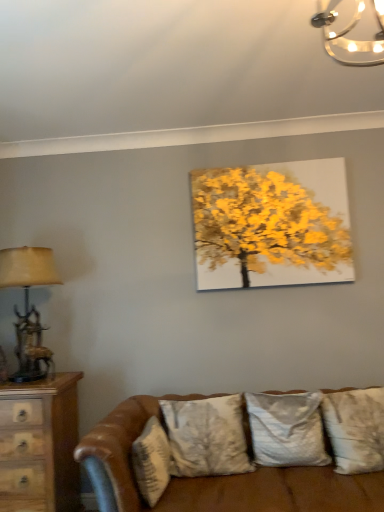
Measure the distance between point (126, 424) and camera.

The depth of point (126, 424) is 2.05 meters.

What do you see at coordinates (213, 477) in the screenshot? The image size is (384, 512). I see `brown leather couch at lower center` at bounding box center [213, 477].

Where is `silky white pillow at center, the 2th pillow viewed from the left`? silky white pillow at center, the 2th pillow viewed from the left is located at coordinates (206, 436).

Describe the element at coordinates (39, 445) in the screenshot. The width and height of the screenshot is (384, 512). I see `wooden chest of drawers at left` at that location.

What do you see at coordinates (350, 31) in the screenshot? I see `metallic glass chandelier at upper right` at bounding box center [350, 31].

This screenshot has width=384, height=512. I want to click on brown leather couch at lower center, so pos(213,477).

Does antler bronze table lamp at left have a greater height compared to wooden chest of drawers at left?

In fact, antler bronze table lamp at left may be shorter than wooden chest of drawers at left.

Could you tell me if antler bronze table lamp at left is turned towards wooden chest of drawers at left?

No, antler bronze table lamp at left does not turn towards wooden chest of drawers at left.

Find the location of a particular element. the chest of drawers in front of the antler bronze table lamp at left is located at coordinates (39, 445).

Is antler bronze table lamp at left located outside wooden chest of drawers at left?

antler bronze table lamp at left lies outside wooden chest of drawers at left's area.

Which point is more distant from viewer, (361,56) or (21,326)?

The point (21,326) is more distant.

Does metallic glass chandelier at upper right have a lesser width compared to antler bronze table lamp at left?

Indeed, metallic glass chandelier at upper right has a lesser width compared to antler bronze table lamp at left.

Which object is positioned more to the left, metallic glass chandelier at upper right or antler bronze table lamp at left?

antler bronze table lamp at left.

From the picture: Can you confirm if brown leather couch at lower center is smaller than antler bronze table lamp at left?

No.

From the picture: From the image's perspective, is brown leather couch at lower center above antler bronze table lamp at left?

No, from the image's perspective, brown leather couch at lower center is not over antler bronze table lamp at left.

Visually, is brown leather couch at lower center positioned to the left or to the right of antler bronze table lamp at left?

Clearly, brown leather couch at lower center is on the right of antler bronze table lamp at left in the image.

How different are the orientations of brown leather couch at lower center and antler bronze table lamp at left in degrees?

0.189 degrees separate the facing orientations of brown leather couch at lower center and antler bronze table lamp at left.

In terms of height, does textured beige pillow at lower right, the 1th pillow when ordered from right to left, look taller or shorter compared to silky white pillow at center, the third pillow viewed from the right?

Clearly, textured beige pillow at lower right, the 1th pillow when ordered from right to left, is shorter compared to silky white pillow at center, the third pillow viewed from the right.

Is point (343, 457) positioned after point (239, 402)?

No.

What's the angular difference between textured beige pillow at lower right, the 1th pillow when ordered from right to left, and silky white pillow at center, the 2th pillow viewed from the left,'s facing directions?

The angular difference between textured beige pillow at lower right, the 1th pillow when ordered from right to left, and silky white pillow at center, the 2th pillow viewed from the left, is 1.16 degrees.

Considering the relative positions of textured beige pillow at lower right, the 1th pillow when ordered from right to left, and silky white pillow at center, the third pillow viewed from the right, in the image provided, is textured beige pillow at lower right, the 1th pillow when ordered from right to left, to the left of silky white pillow at center, the third pillow viewed from the right, from the viewer's perspective?

Incorrect, textured beige pillow at lower right, the 1th pillow when ordered from right to left, is not on the left side of silky white pillow at center, the third pillow viewed from the right.

Is point (343, 449) less distant than point (327, 502)?

No, it is not.

From the picture: Is textured beige pillow at lower right, the 1th pillow when ordered from right to left, beside brown leather couch at lower center?

No, textured beige pillow at lower right, the 1th pillow when ordered from right to left, is not with brown leather couch at lower center.

Considering the sizes of objects textured beige pillow at lower right, the 1th pillow when ordered from right to left, and brown leather couch at lower center in the image provided, who is shorter, textured beige pillow at lower right, the 1th pillow when ordered from right to left, or brown leather couch at lower center?

textured beige pillow at lower right, the 1th pillow when ordered from right to left.

The height and width of the screenshot is (512, 384). There is a brown leather couch at lower center. In order to click on the 4th pillow above it (from the image's perspective) in this screenshot , I will do `click(356, 429)`.

Is metallic glass chandelier at upper right smaller than wooden chest of drawers at left?

Indeed, metallic glass chandelier at upper right has a smaller size compared to wooden chest of drawers at left.

Does point (333, 18) lie behind point (18, 463)?

That is False.

Considering the sizes of objects metallic glass chandelier at upper right and wooden chest of drawers at left in the image provided, who is thinner, metallic glass chandelier at upper right or wooden chest of drawers at left?

metallic glass chandelier at upper right.

From a real-world perspective, is metallic glass chandelier at upper right positioned above or below wooden chest of drawers at left?

Clearly, from a real-world perspective, metallic glass chandelier at upper right is above wooden chest of drawers at left.

Is textured gray pillow at lower center, which is the 1th pillow from left to right, taller or shorter than wooden chest of drawers at left?

In the image, textured gray pillow at lower center, which is the 1th pillow from left to right, appears to be shorter than wooden chest of drawers at left.

Is textured gray pillow at lower center, positioned as the fourth pillow in right-to-left order, looking in the opposite direction of wooden chest of drawers at left?

Yes, textured gray pillow at lower center, positioned as the fourth pillow in right-to-left order, is positioned with its back facing wooden chest of drawers at left.

Which object is further away from the camera, textured gray pillow at lower center, which is the 1th pillow from left to right, or wooden chest of drawers at left?

wooden chest of drawers at left is behind.

The image size is (384, 512). Identify the location of the chest of drawers in front of the antler bronze table lamp at left. (39, 445).

Find the location of `table lamp that is on the left side of metallic glass chandelier at upper right`. table lamp that is on the left side of metallic glass chandelier at upper right is located at coordinates (29, 307).

From the image, which object appears to be farther from metallic glass chandelier at upper right, brown leather couch at lower center or silky gray pillow at center, marked as the second pillow in a right-to-left arrangement?

brown leather couch at lower center is positioned further to the anchor metallic glass chandelier at upper right.

Looking at the image, which one is located closer to brown leather couch at lower center, silky gray pillow at center, marked as the second pillow in a right-to-left arrangement, or textured beige pillow at lower right, the 1th pillow when ordered from right to left?

silky gray pillow at center, marked as the second pillow in a right-to-left arrangement, is positioned closer to the anchor brown leather couch at lower center.

Based on the photo, estimate the real-world distances between objects in this image. Which object is further from wooden chest of drawers at left, antler bronze table lamp at left or metallic glass chandelier at upper right?

Based on the image, metallic glass chandelier at upper right appears to be further to wooden chest of drawers at left.

Which object lies nearer to the anchor point wooden chest of drawers at left, metallic glass chandelier at upper right or brown leather couch at lower center?

brown leather couch at lower center.

Based on their spatial positions, is silky gray pillow at center, marked as the second pillow in a right-to-left arrangement, or silky white pillow at center, the third pillow viewed from the right, further from wooden chest of drawers at left?

Among the two, silky gray pillow at center, marked as the second pillow in a right-to-left arrangement, is located further to wooden chest of drawers at left.

When comparing their distances from silky gray pillow at center, which appears as the third pillow when viewed from the left, does silky white pillow at center, the third pillow viewed from the right, or wooden chest of drawers at left seem further?

The object further to silky gray pillow at center, which appears as the third pillow when viewed from the left, is wooden chest of drawers at left.

Considering their positions, is textured beige pillow at lower right, which is counted as the 4th pillow, starting from the left, positioned further to textured gray pillow at lower center, positioned as the fourth pillow in right-to-left order, than brown leather couch at lower center?

textured beige pillow at lower right, which is counted as the 4th pillow, starting from the left, is further to textured gray pillow at lower center, positioned as the fourth pillow in right-to-left order.

Based on their spatial positions, is silky gray pillow at center, which appears as the third pillow when viewed from the left, or metallic glass chandelier at upper right further from silky white pillow at center, the third pillow viewed from the right?

Based on the image, metallic glass chandelier at upper right appears to be further to silky white pillow at center, the third pillow viewed from the right.

Find the location of a particular element. The width and height of the screenshot is (384, 512). studio couch between textured gray pillow at lower center, positioned as the fourth pillow in right-to-left order, and silky gray pillow at center, which appears as the third pillow when viewed from the left, in the horizontal direction is located at coordinates (213, 477).

You are a GUI agent. You are given a task and a screenshot of the screen. Output one action in this format:
    pyautogui.click(x=<x>, y=<y>)
    Task: Click on the studio couch between silky white pillow at center, the third pillow viewed from the right, and textured beige pillow at lower right, which is counted as the 4th pillow, starting from the left, from left to right
    
    Given the screenshot: What is the action you would take?
    pyautogui.click(x=213, y=477)

What are the coordinates of `studio couch between antler bronze table lamp at left and silky gray pillow at center, which appears as the third pillow when viewed from the left, from left to right` in the screenshot? It's located at (213, 477).

I want to click on table lamp between metallic glass chandelier at upper right and textured gray pillow at lower center, which is the 1th pillow from left to right, in the up-down direction, so click(x=29, y=307).